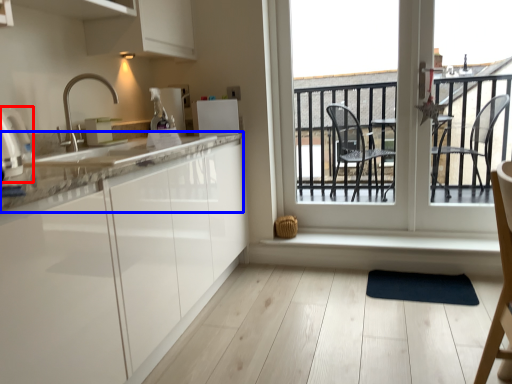
Question: Which object is further to the camera taking this photo, appliance (highlighted by a red box) or countertop (highlighted by a blue box)?

Choices:
 (A) appliance
 (B) countertop

Answer: (B)